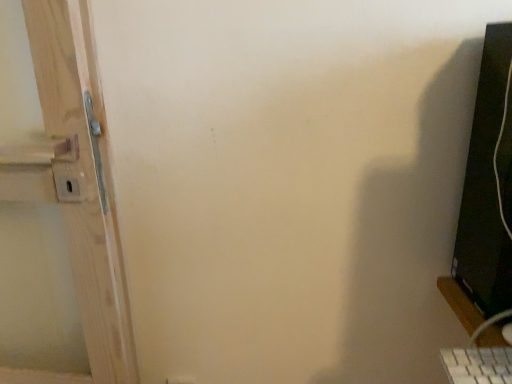
This screenshot has width=512, height=384. Describe the element at coordinates (478, 365) in the screenshot. I see `white plastic keyboard at lower right` at that location.

Where is `white plastic keyboard at lower right`? white plastic keyboard at lower right is located at coordinates (478, 365).

What are the coordinates of `white plastic keyboard at lower right` in the screenshot? It's located at (478, 365).